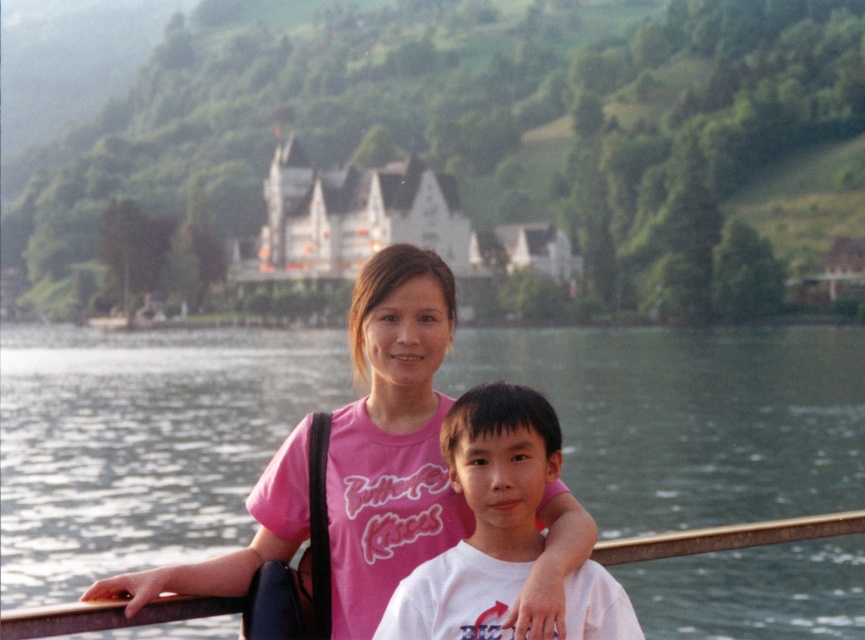
Is pink fabric shirt at center positioned in front of white cotton shirt at center?

Yes.

Which of these two, pink fabric shirt at center or white cotton shirt at center, stands shorter?

white cotton shirt at center

Who is more forward, (363, 604) or (426, 589)?

Positioned in front is point (426, 589).

What are the coordinates of `pink fabric shirt at center` in the screenshot? It's located at tap(391, 436).